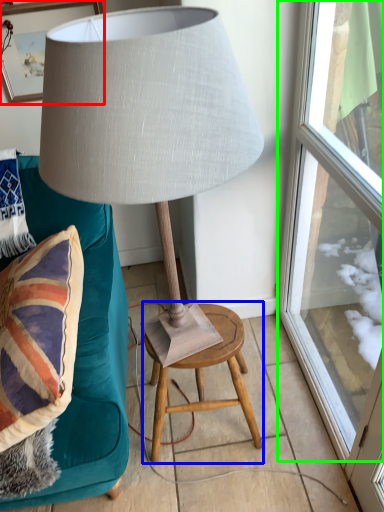
Question: Which object is positioned closest to picture frame (highlighted by a red box)? Select from stool (highlighted by a blue box) and window (highlighted by a green box).

Choices:
 (A) stool
 (B) window

Answer: (B)